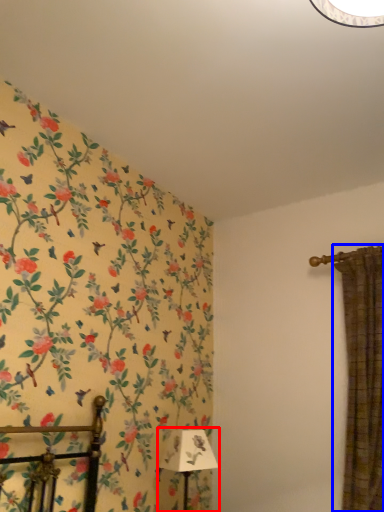
Question: Which of the following is the farthest to the observer, table lamp (highlighted by a red box) or curtain (highlighted by a blue box)?

Choices:
 (A) table lamp
 (B) curtain

Answer: (A)